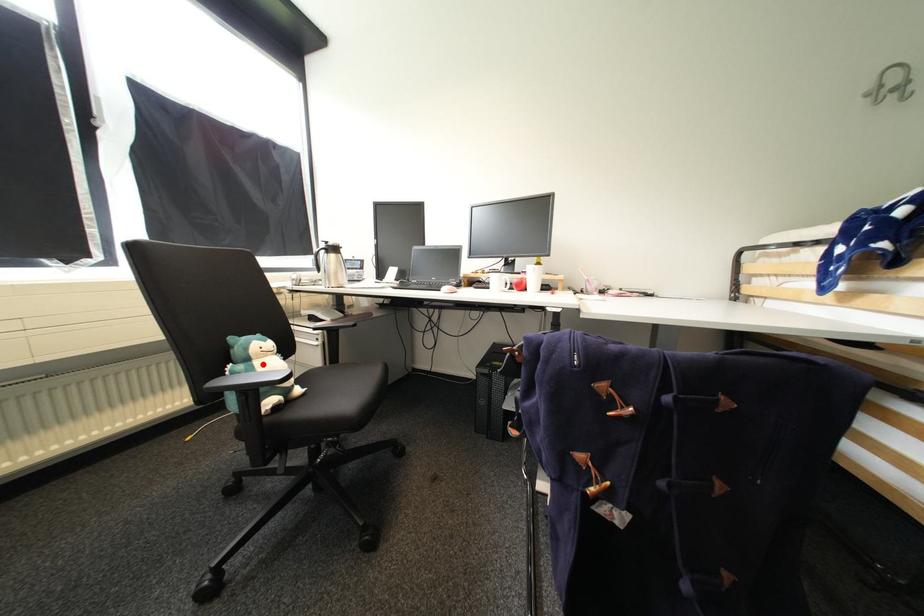
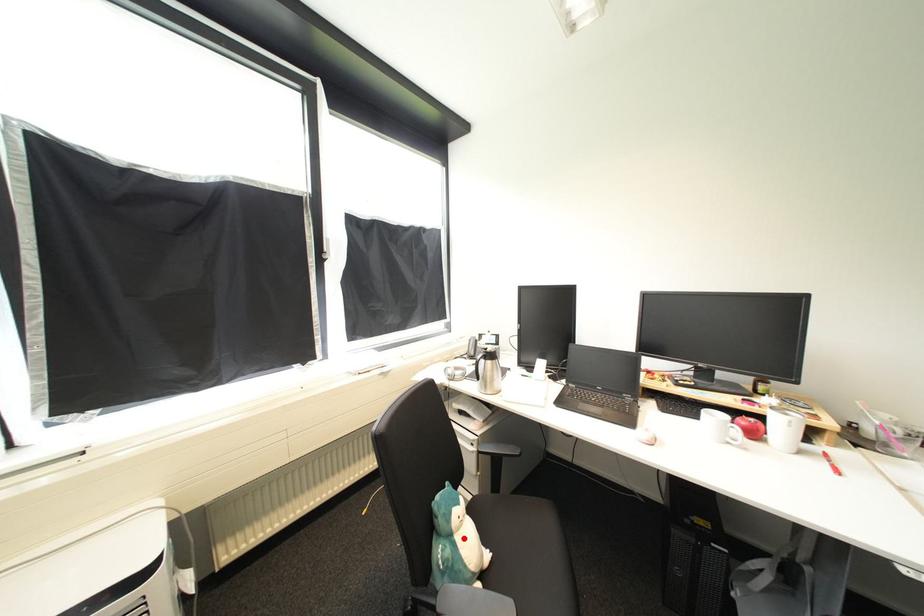
I am providing you with two images of the same scene from different viewpoints. A red point is marked on the first image and another point is marked on the second image. Is the red point in image1 aligned with the point shown in image2?

Yes